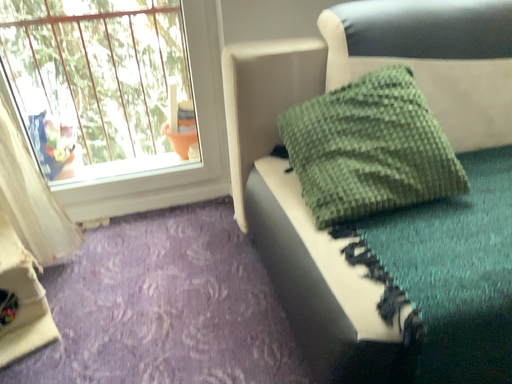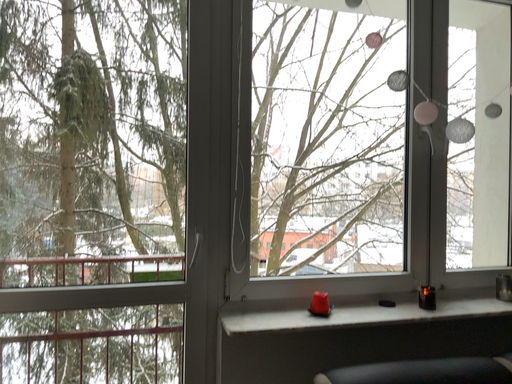
Question: How did the camera likely rotate when shooting the video?

Choices:
 (A) rotated upward
 (B) rotated downward

Answer: (A)